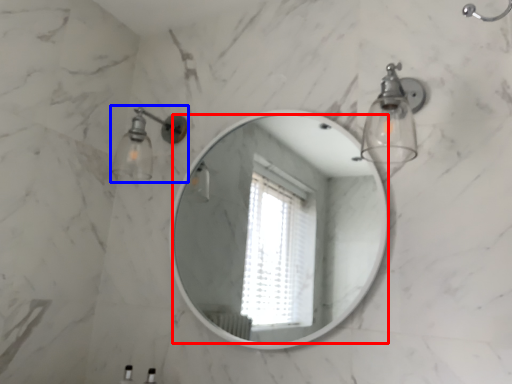
Question: Which point is closer to the camera, mirror (highlighted by a red box) or light fixture (highlighted by a blue box)?

Choices:
 (A) mirror
 (B) light fixture

Answer: (A)